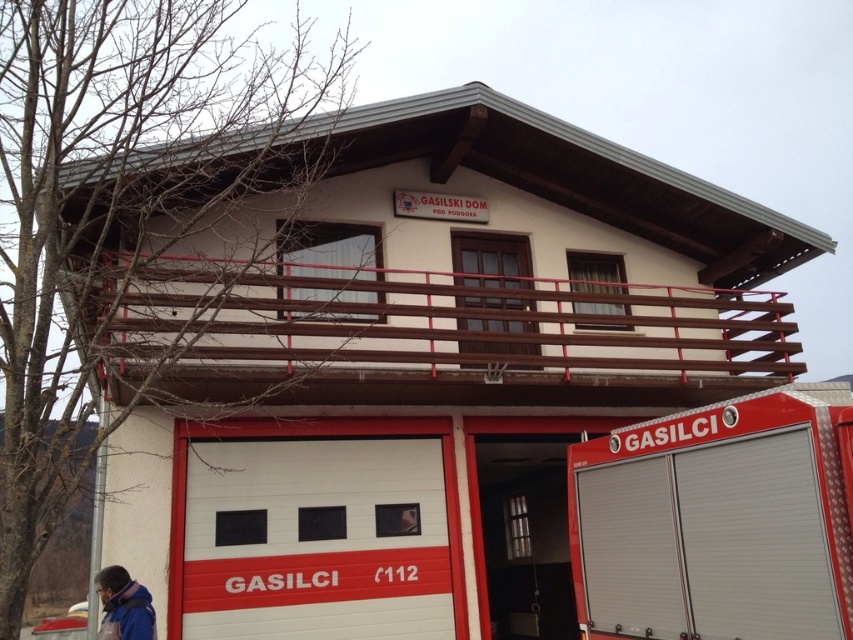
Is metallic silver fire truck at lower right closer to camera compared to blue fabric jacket at lower left?

Yes, metallic silver fire truck at lower right is closer to the viewer.

Can you confirm if metallic silver fire truck at lower right is positioned above blue fabric jacket at lower left?

Indeed, metallic silver fire truck at lower right is positioned over blue fabric jacket at lower left.

Is point (804, 628) in front of point (132, 592)?

That is True.

Where is `metallic silver fire truck at lower right`? The width and height of the screenshot is (853, 640). metallic silver fire truck at lower right is located at coordinates (717, 522).